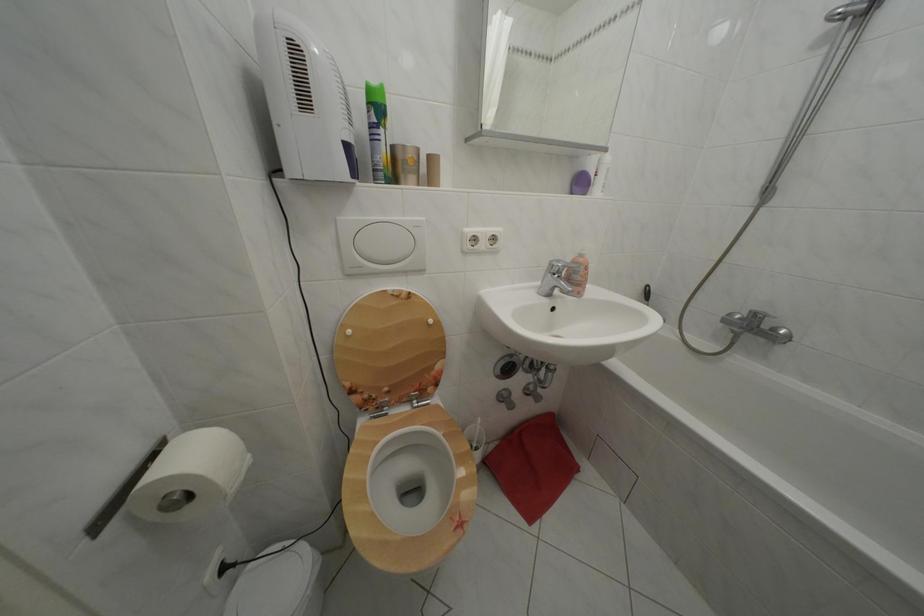
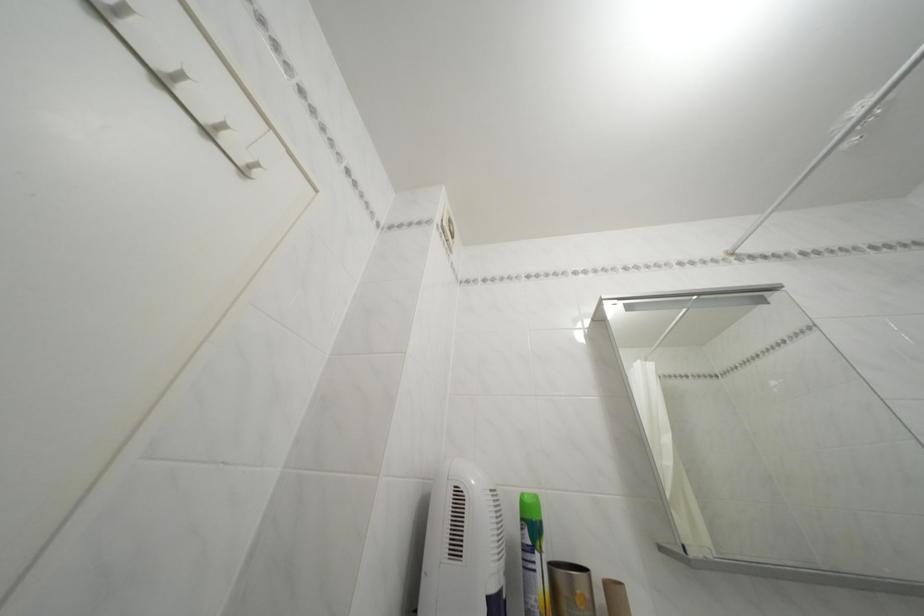
The point at (391, 137) is marked in the first image. Where is the corresponding point in the second image?

(545, 562)